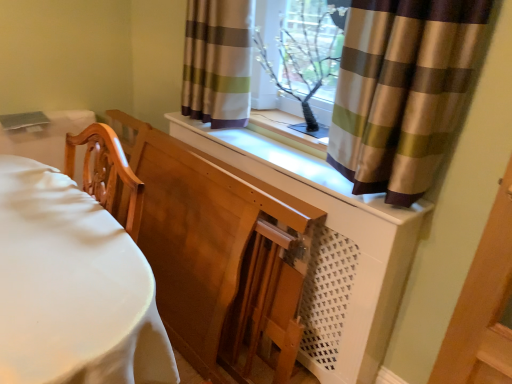
Question: In the image, is wooden chair at left positioned in front of or behind brown striped curtain at upper center, the first curtain positioned from the front?

Choices:
 (A) front
 (B) behind

Answer: (A)

Question: Is point (50, 364) closer or farther from the camera than point (395, 115)?

Choices:
 (A) farther
 (B) closer

Answer: (B)

Question: Based on their relative distances, which object is farther from the brown striped curtain at upper center, which is the 1th curtain from right to left?

Choices:
 (A) striped fabric curtain at upper center, arranged as the 2th curtain when viewed from the front
 (B) wooden chair at left
 (C) white matte dresser at center
 (D) clear glass window frame at upper center

Answer: (B)

Question: Which is nearer to the wooden chair at left?

Choices:
 (A) clear glass window frame at upper center
 (B) white matte dresser at center
 (C) brown striped curtain at upper center, which ranks as the second curtain in left-to-right order
 (D) striped fabric curtain at upper center, which is counted as the 2th curtain, starting from the right

Answer: (B)